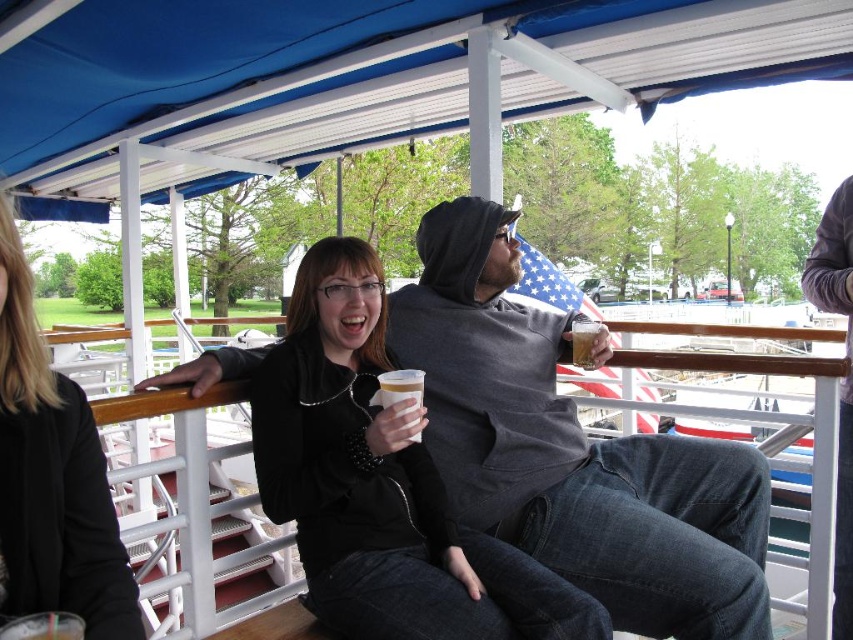
Question: Which point is closer to the camera taking this photo?

Choices:
 (A) (577, 346)
 (B) (438, 541)
 (C) (407, 396)

Answer: (C)

Question: Which point appears closest to the camera in this image?

Choices:
 (A) (387, 385)
 (B) (556, 586)

Answer: (B)

Question: Is dark gray hoodie at center closer to the viewer compared to white plastic cup at center?

Choices:
 (A) no
 (B) yes

Answer: (B)

Question: Among these objects, which one is farthest from the camera?

Choices:
 (A) dark gray hoodie at center
 (B) matte black jacket at center
 (C) translucent plastic cup at upper center

Answer: (C)

Question: Where is dark gray hoodie at center located in relation to matte black jacket at center in the image?

Choices:
 (A) above
 (B) below

Answer: (B)

Question: Does dark gray hoodie at center have a greater width compared to translucent plastic cup at upper center?

Choices:
 (A) no
 (B) yes

Answer: (B)